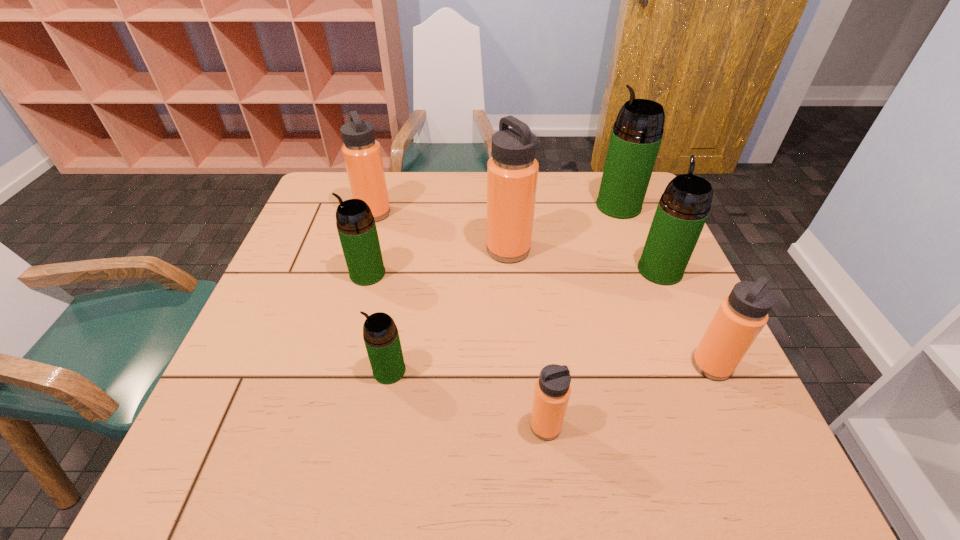
Where is `the farthest green thermos bottle`? the farthest green thermos bottle is located at coordinates (636, 136).

Locate an element on the screen. This screenshot has height=540, width=960. the second farthest orange thermos bottle is located at coordinates (512, 172).

Where is `the third smallest green thermos bottle`? This screenshot has width=960, height=540. the third smallest green thermos bottle is located at coordinates (683, 208).

Where is `the farthest orange thermos bottle`? The height and width of the screenshot is (540, 960). the farthest orange thermos bottle is located at coordinates (362, 154).

Where is `the second biggest orange thermos bottle`? This screenshot has width=960, height=540. the second biggest orange thermos bottle is located at coordinates (362, 154).

Locate an element on the screen. The image size is (960, 540). the leftmost green thermos bottle is located at coordinates (356, 227).

The width and height of the screenshot is (960, 540). What are the coordinates of `the second nearest orange thermos bottle` in the screenshot? It's located at (741, 316).

Find the location of `the rightmost orange thermos bottle`. the rightmost orange thermos bottle is located at coordinates pos(741,316).

This screenshot has height=540, width=960. I want to click on the sixth object from right to left, so click(x=380, y=333).

Identify the location of the nearest green thermos bottle. The image size is (960, 540). (380, 333).